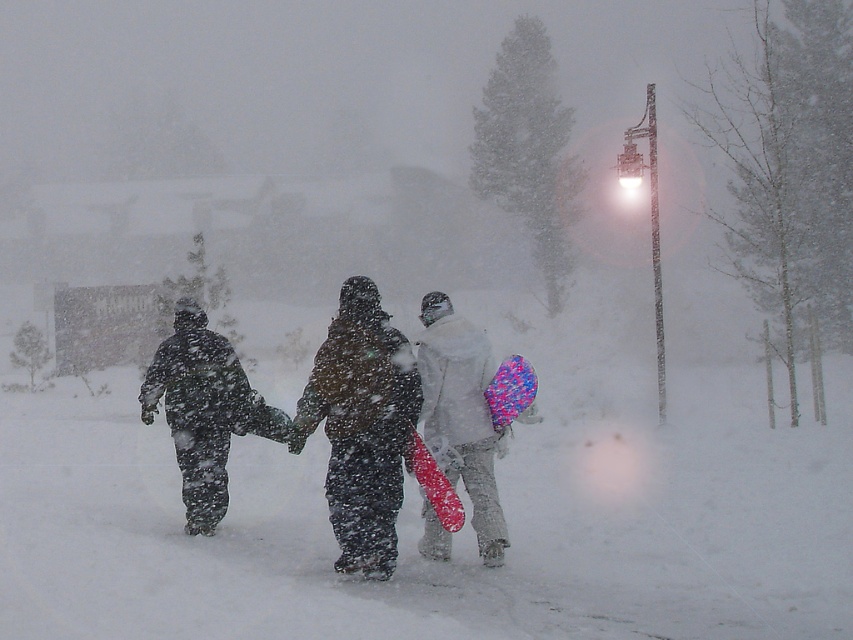
Is matte pink snowboard at center bigger than shiny red snowboard at center?

No.

Is matte pink snowboard at center in front of shiny red snowboard at center?

No, it is not.

Who is more forward, (410, 444) or (419, 452)?

Positioned in front is point (419, 452).

I want to click on matte pink snowboard at center, so click(511, 388).

Does dark matte snowsuit at center lie in front of matte pink snowboard at center?

Yes, it is in front of matte pink snowboard at center.

Does dark matte snowsuit at center come behind matte pink snowboard at center?

That is False.

Describe the element at coordinates (363, 426) in the screenshot. I see `dark matte snowsuit at center` at that location.

At what (x,y) coordinates should I click in order to perform the action: click on dark matte snowsuit at center. Please return your answer as a coordinate pair (x, y). This screenshot has height=640, width=853. Looking at the image, I should click on (363, 426).

Does dark matte snowsuit at center appear on the right side of shiny red snowboard at center?

In fact, dark matte snowsuit at center is to the left of shiny red snowboard at center.

Is dark matte snowsuit at center above shiny red snowboard at center?

Yes, dark matte snowsuit at center is above shiny red snowboard at center.

Is point (403, 420) behind point (439, 513)?

Yes, point (403, 420) is farther from viewer.

Identify the location of dark matte snowsuit at center. (363, 426).